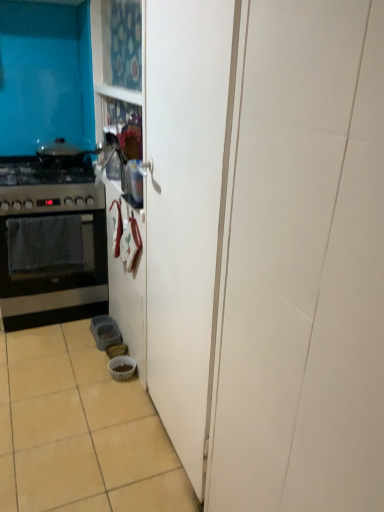
I want to click on beige ceramic tile at lower left, so click(80, 431).

Describe the element at coordinates (122, 367) in the screenshot. Image resolution: width=384 pixels, height=512 pixels. I see `white glossy bowl at lower center` at that location.

Identify the location of white glossy bowl at lower center. (122, 367).

Locate an element on the screen. This screenshot has height=512, width=384. stainless steel oven at left is located at coordinates click(x=51, y=244).

Describe the element at coordinates (62, 153) in the screenshot. I see `shiny silver pot at left` at that location.

Locate an element on the screen. The width and height of the screenshot is (384, 512). black matte gas stove at left is located at coordinates [x=46, y=188].

The height and width of the screenshot is (512, 384). In order to click on beige ceramic tile at lower left in this screenshot , I will do `click(80, 431)`.

Does black matte oven at left have a smaller size compared to beige ceramic tile at lower left?

Yes, black matte oven at left is smaller than beige ceramic tile at lower left.

Is black matte oven at left touching beige ceramic tile at lower left?

They are not placed beside each other.

Considering the relative sizes of black matte oven at left and beige ceramic tile at lower left in the image provided, is black matte oven at left wider than beige ceramic tile at lower left?

Incorrect, the width of black matte oven at left does not surpass that of beige ceramic tile at lower left.

From a real-world perspective, is black matte oven at left positioned under beige ceramic tile at lower left based on gravity?

No, from a real-world perspective, black matte oven at left is not under beige ceramic tile at lower left.

From the image's perspective, is black matte gas stove at left over black matte oven at left?

Indeed, from the image's perspective, black matte gas stove at left is shown above black matte oven at left.

Is black matte gas stove at left facing towards black matte oven at left?

No, black matte gas stove at left does not turn towards black matte oven at left.

From a real-world perspective, which is physically below, black matte gas stove at left or black matte oven at left?

In real-world perspective, black matte oven at left is lower.

Which of these two, black matte gas stove at left or black matte oven at left, stands shorter?

black matte gas stove at left.

Could you tell me if white glossy bowl at lower center is turned towards white matte door at center?

No, white glossy bowl at lower center is not facing towards white matte door at center.

From the image's perspective, would you say white glossy bowl at lower center is positioned over white matte door at center?

No, from the image's perspective, white glossy bowl at lower center is not on top of white matte door at center.

Which of these two, white glossy bowl at lower center or white matte door at center, stands shorter?

Standing shorter between the two is white glossy bowl at lower center.

Between white glossy bowl at lower center and beige ceramic tile at lower left, which one appears on the left side from the viewer's perspective?

beige ceramic tile at lower left is more to the left.

Is white glossy bowl at lower center facing towards beige ceramic tile at lower left?

Yes, white glossy bowl at lower center is oriented towards beige ceramic tile at lower left.

How different are the orientations of white glossy bowl at lower center and beige ceramic tile at lower left in degrees?

There is a 89-degree angle between the facing directions of white glossy bowl at lower center and beige ceramic tile at lower left.

In the scene shown: From a real-world perspective, who is located lower, white glossy bowl at lower center or beige ceramic tile at lower left?

beige ceramic tile at lower left, from a real-world perspective.

Consider the image. Is beige ceramic tile at lower left completely or partially outside of black matte gas stove at left?

Indeed, beige ceramic tile at lower left is completely outside black matte gas stove at left.

Could you tell me if beige ceramic tile at lower left is facing black matte gas stove at left?

No, beige ceramic tile at lower left is not oriented towards black matte gas stove at left.

Considering the points (72, 464) and (33, 172), which point is in front, point (72, 464) or point (33, 172)?

Positioned in front is point (72, 464).

Between point (183, 166) and point (127, 410), which one is positioned behind?

Positioned behind is point (127, 410).

What's the angular difference between white matte door at center and beige ceramic tile at lower left's facing directions?

white matte door at center and beige ceramic tile at lower left are facing 89.7 degrees away from each other.

From a real-world perspective, which is physically below, white matte door at center or beige ceramic tile at lower left?

beige ceramic tile at lower left.

Can you confirm if white matte door at center is bigger than beige ceramic tile at lower left?

Yes, white matte door at center is bigger than beige ceramic tile at lower left.

From the image's perspective, between white matte door at center and stainless steel oven at left, which one is located above?

stainless steel oven at left appears higher in the image.

Is white matte door at center facing towards stainless steel oven at left?

No, white matte door at center is not aimed at stainless steel oven at left.

Is white matte door at center situated inside stainless steel oven at left or outside?

white matte door at center is not enclosed by stainless steel oven at left.

Considering the sizes of objects white matte door at center and stainless steel oven at left in the image provided, who is bigger, white matte door at center or stainless steel oven at left?

stainless steel oven at left is bigger.

Find the location of a particular element. This screenshot has width=384, height=512. ceramic tile that is below the black matte oven at left (from the image's perspective) is located at coordinates (80, 431).

Where is `gas stove located on the left of black matte oven at left`? This screenshot has width=384, height=512. gas stove located on the left of black matte oven at left is located at coordinates (46, 188).

Based on their spatial positions, is black matte gas stove at left or shiny silver pot at left further from white glossy bowl at lower center?

shiny silver pot at left is further to white glossy bowl at lower center.

Which object lies nearer to the anchor point black matte gas stove at left, black matte oven at left or white glossy bowl at lower center?

black matte oven at left is closer to black matte gas stove at left.

Estimate the real-world distances between objects in this image. Which object is closer to white glossy bowl at lower center, black matte oven at left or beige ceramic tile at lower left?

Based on the image, beige ceramic tile at lower left appears to be nearer to white glossy bowl at lower center.

Looking at the image, which one is located further to white glossy bowl at lower center, shiny silver pot at left or stainless steel oven at left?

shiny silver pot at left lies further to white glossy bowl at lower center than the other object.

Which object lies further to the anchor point shiny silver pot at left, black matte gas stove at left or black matte oven at left?

black matte oven at left is further to shiny silver pot at left.

Looking at the image, which one is located further to shiny silver pot at left, beige ceramic tile at lower left or white glossy bowl at lower center?

beige ceramic tile at lower left is further to shiny silver pot at left.

Considering their positions, is white glossy bowl at lower center positioned further to beige ceramic tile at lower left than black matte oven at left?

black matte oven at left is positioned further to the anchor beige ceramic tile at lower left.

When comparing their distances from shiny silver pot at left, does beige ceramic tile at lower left or stainless steel oven at left seem further?

Among the two, beige ceramic tile at lower left is located further to shiny silver pot at left.

Where is `gas stove between shiny silver pot at left and stainless steel oven at left from top to bottom`? The image size is (384, 512). gas stove between shiny silver pot at left and stainless steel oven at left from top to bottom is located at coordinates (46, 188).

Where is `ceramic tile between white matte door at center and black matte oven at left from front to back`? The width and height of the screenshot is (384, 512). ceramic tile between white matte door at center and black matte oven at left from front to back is located at coordinates (80, 431).

In order to click on ceramic tile between white matte door at center and stainless steel oven at left along the z-axis in this screenshot , I will do `click(80, 431)`.

Identify the location of gas stove between white matte door at center and shiny silver pot at left along the z-axis. (46, 188).